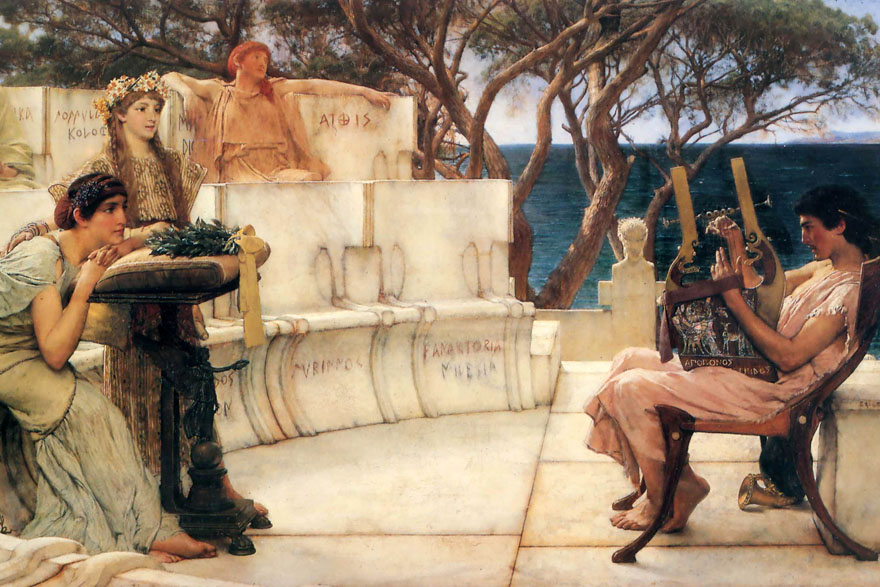
Find the location of `sappho & alcaeus canvas print`. sappho & alcaeus canvas print is located at coordinates (356, 149).